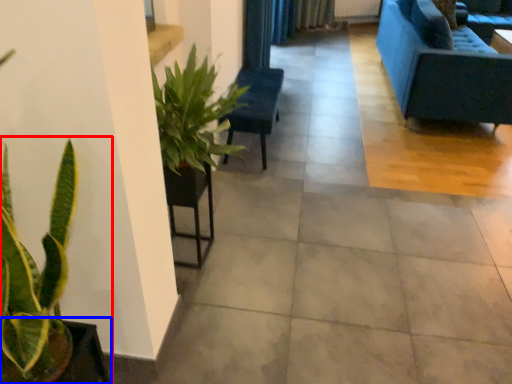
Question: Which object appears closest to the camera in this image, houseplant (highlighted by a red box) or flowerpot (highlighted by a blue box)?

Choices:
 (A) houseplant
 (B) flowerpot

Answer: (A)